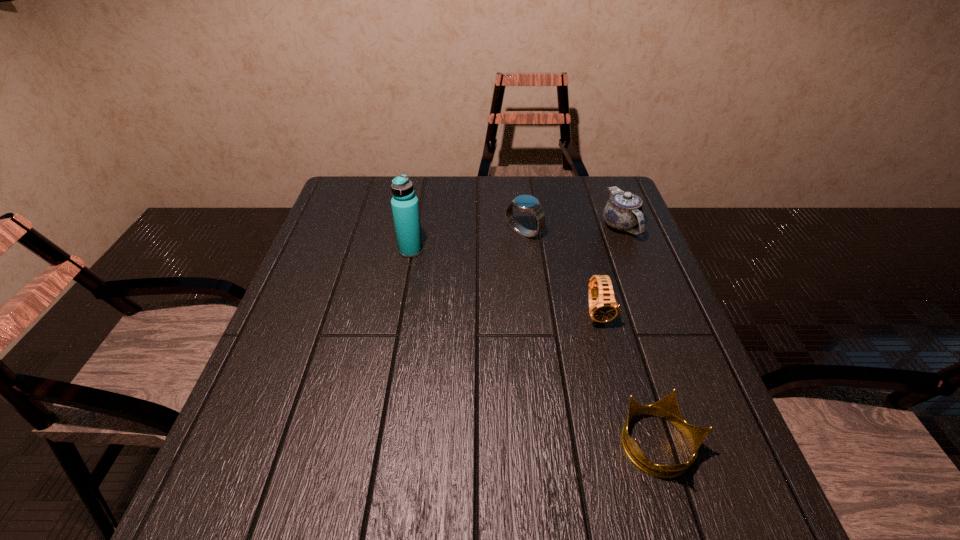
Where is `free space between the chinaware and the leftmost object`? The height and width of the screenshot is (540, 960). free space between the chinaware and the leftmost object is located at coordinates (516, 238).

Locate an element on the screen. vacant space in between the chinaware and the farther watch is located at coordinates (572, 230).

This screenshot has width=960, height=540. In order to click on free space between the water bottle and the chinaware in this screenshot , I will do `click(516, 238)`.

Where is `free space between the chinaware and the nearer watch`? Image resolution: width=960 pixels, height=540 pixels. free space between the chinaware and the nearer watch is located at coordinates (609, 269).

The image size is (960, 540). I want to click on free space between the chinaware and the nearest object, so click(639, 336).

Image resolution: width=960 pixels, height=540 pixels. What are the coordinates of `empty location between the farther watch and the second nearest object` in the screenshot? It's located at (561, 273).

Choose which object is the nearest neighbor to the tallest object. Please provide its 2D coordinates. Your answer should be formatted as a tuple, i.e. [(x, y)], where the tuple contains the x and y coordinates of a point satisfying the conditions above.

[(525, 203)]

Point out which object is positioned as the second nearest to the shortest object. Please provide its 2D coordinates. Your answer should be formatted as a tuple, i.e. [(x, y)], where the tuple contains the x and y coordinates of a point satisfying the conditions above.

[(623, 211)]

The image size is (960, 540). I want to click on vacant space that satisfies the following two spatial constraints: 1. on the face of the right watch; 2. on the left side of the shortest object, so click(x=633, y=446).

At what (x,y) coordinates should I click in order to perform the action: click on vacant region that satisfies the following two spatial constraints: 1. on the back side of the water bottle; 2. on the right side of the left watch. Please return your answer as a coordinate pair (x, y). Looking at the image, I should click on (415, 233).